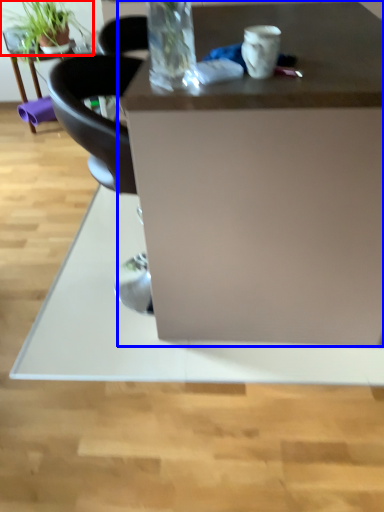
Question: Which of the following is the closest to the observer, houseplant (highlighted by a red box) or desk (highlighted by a blue box)?

Choices:
 (A) houseplant
 (B) desk

Answer: (B)